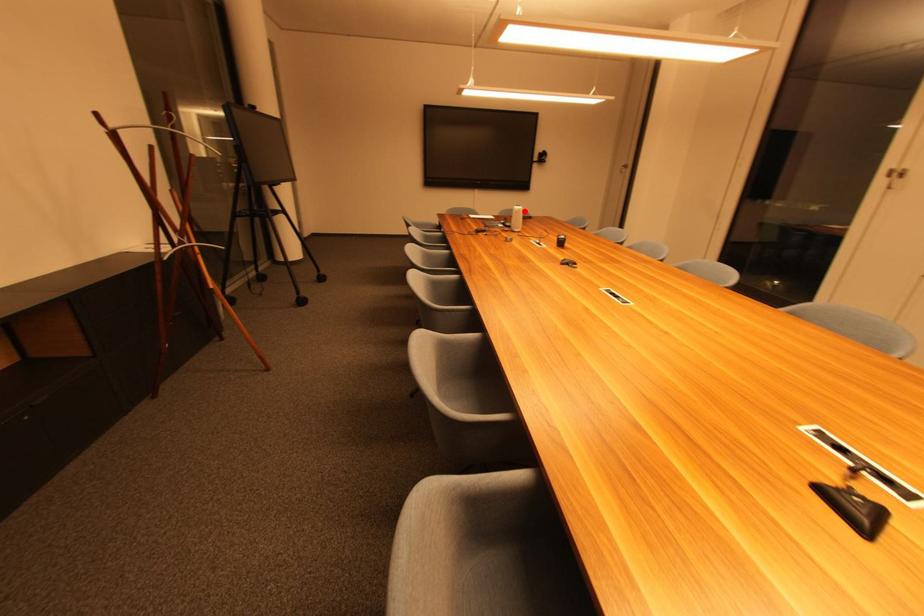
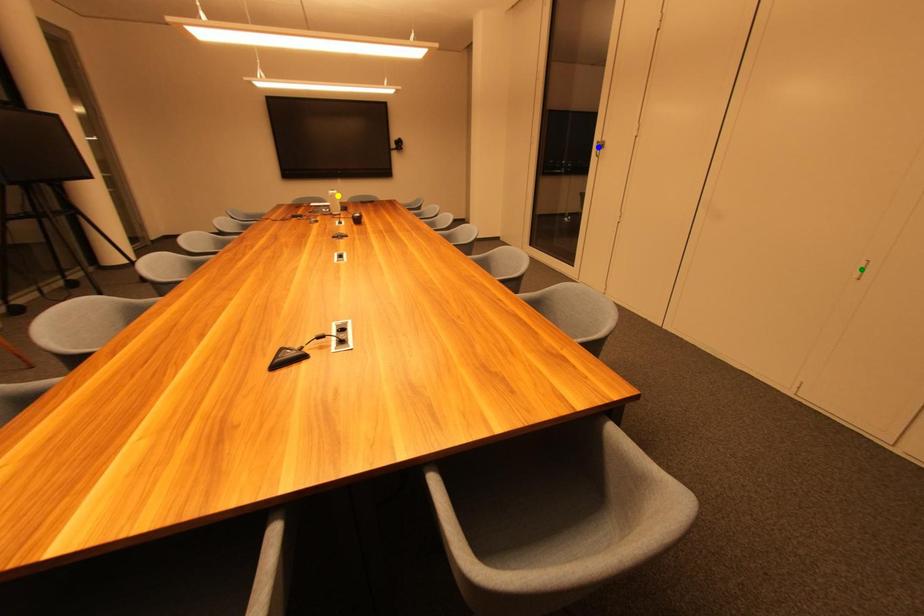
Question: I am providing you with two images of the same scene from different viewpoints. A red point is marked on the first image. You are given multiple points on the second image. Which point in image 2 represents the same 3d spot as the red point in image 1?

Choices:
 (A) blue point
 (B) green point
 (C) yellow point

Answer: (C)